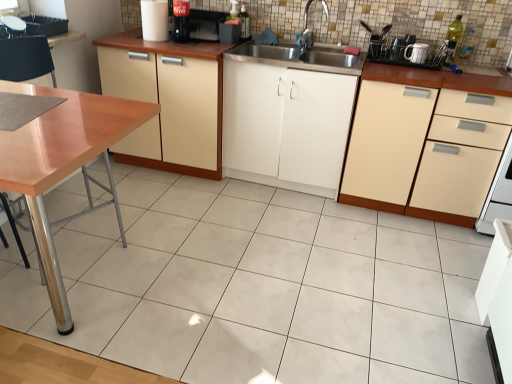
Where is `free space in front of white glossy mug at upper right`? free space in front of white glossy mug at upper right is located at coordinates tap(416, 72).